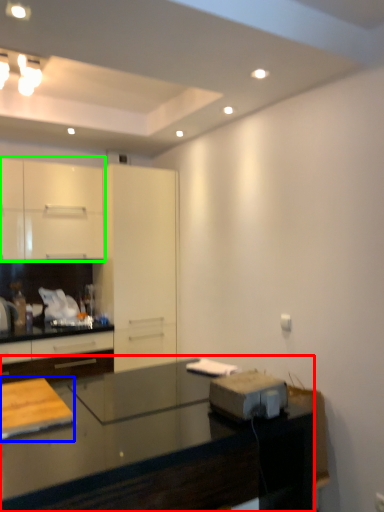
Question: Estimate the real-world distances between objects in this image. Which object is closer to countertop (highlighted by a red box), table (highlighted by a blue box) or cabinetry (highlighted by a green box)?

Choices:
 (A) table
 (B) cabinetry

Answer: (A)